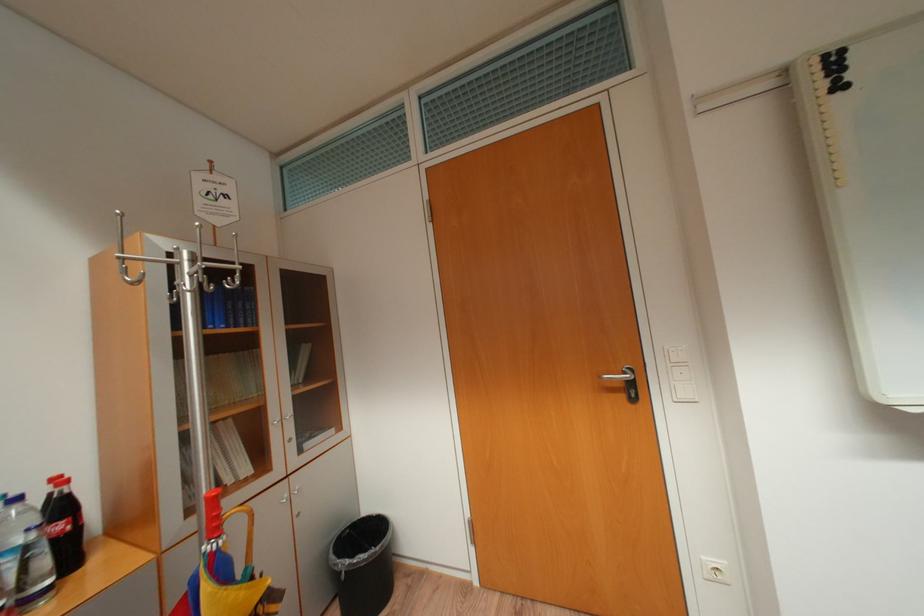
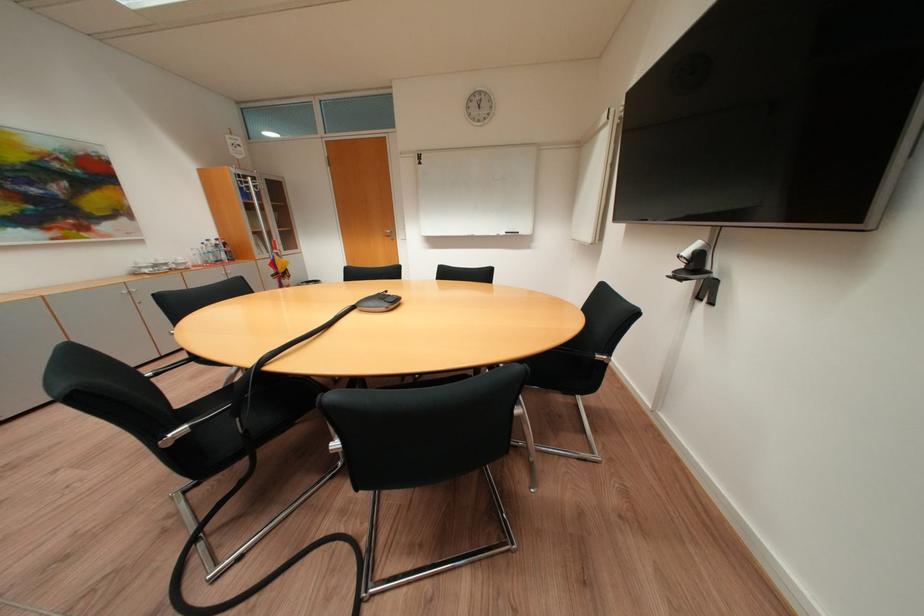
Question: In a continuous first-person perspective shot, in which direction is the camera moving?

Choices:
 (A) Left
 (B) Right
 (C) Forward
 (D) Backward

Answer: (D)